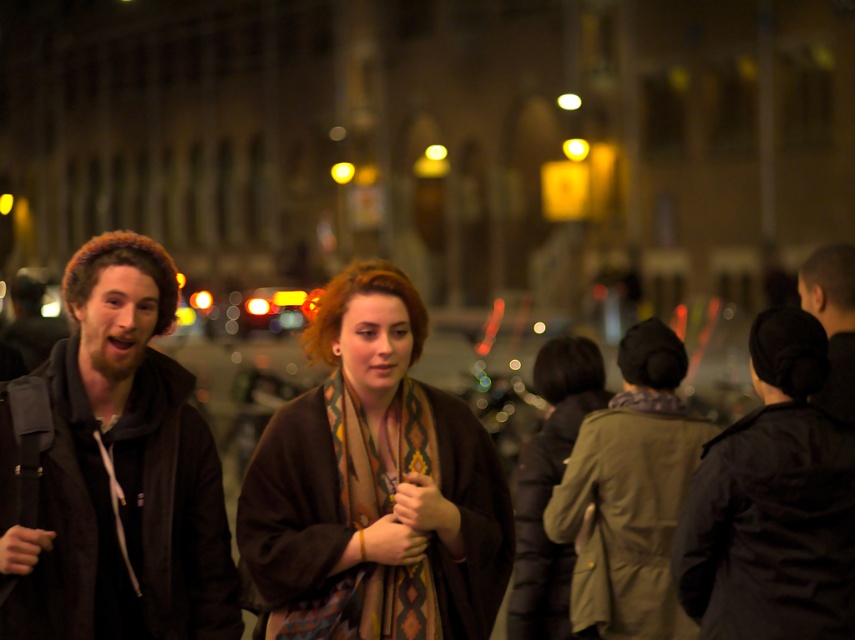
Question: Is brown wool coat at center closer to camera compared to multicolored woven scarf at center?

Choices:
 (A) no
 (B) yes

Answer: (B)

Question: Which of the following is the farthest from the observer?

Choices:
 (A) (522, 476)
 (B) (818, 280)
 (C) (800, 353)
 (D) (391, 275)

Answer: (B)

Question: Is black matte jacket at center positioned behind dark gray hoodie at right?

Choices:
 (A) yes
 (B) no

Answer: (B)

Question: Which point is closer to the camera?

Choices:
 (A) (157, 285)
 (B) (325, 614)
 (C) (113, 602)
 (D) (405, 356)

Answer: (C)

Question: Is brown woolen coat at center further to the viewer compared to black matte jacket at center?

Choices:
 (A) no
 (B) yes

Answer: (B)

Question: Which of the following is the closest to the observer?

Choices:
 (A) (93, 342)
 (B) (722, 584)
 (C) (547, 403)
 (D) (799, 289)

Answer: (A)